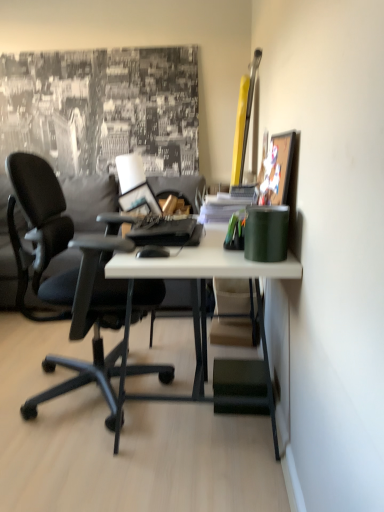
Question: Is white matte desk at center further to the viewer compared to green matte cup at right, placed as the first stationery when sorted from front to back?

Choices:
 (A) no
 (B) yes

Answer: (B)

Question: Does white matte desk at center have a greater width compared to green matte cup at right, placed as the first stationery when sorted from front to back?

Choices:
 (A) yes
 (B) no

Answer: (A)

Question: From the image's perspective, is white matte desk at center on top of green matte cup at right, which is the 2th stationery in back-to-front order?

Choices:
 (A) yes
 (B) no

Answer: (B)

Question: Is white matte desk at center outside of green matte cup at right, placed as the first stationery when sorted from front to back?

Choices:
 (A) no
 (B) yes

Answer: (B)

Question: Is white matte desk at center oriented away from green matte cup at right, which is the 2th stationery in back-to-front order?

Choices:
 (A) yes
 (B) no

Answer: (B)

Question: Is white matte desk at center not near green matte cup at right, placed as the first stationery when sorted from front to back?

Choices:
 (A) no
 (B) yes

Answer: (A)

Question: From the image's perspective, is satin black laptop at center beneath green matte cup at right, which is the 2th stationery in back-to-front order?

Choices:
 (A) no
 (B) yes

Answer: (A)

Question: Considering the relative sizes of satin black laptop at center and green matte cup at right, which is the 2th stationery in back-to-front order, in the image provided, is satin black laptop at center bigger than green matte cup at right, which is the 2th stationery in back-to-front order,?

Choices:
 (A) yes
 (B) no

Answer: (A)

Question: Considering the relative sizes of satin black laptop at center and green matte cup at right, which is the 2th stationery in back-to-front order, in the image provided, is satin black laptop at center thinner than green matte cup at right, which is the 2th stationery in back-to-front order,?

Choices:
 (A) yes
 (B) no

Answer: (B)

Question: Is satin black laptop at center closer to the viewer compared to green matte cup at right, which is the 2th stationery in back-to-front order?

Choices:
 (A) no
 (B) yes

Answer: (A)

Question: Is satin black laptop at center to the right of green matte cup at right, placed as the first stationery when sorted from front to back, from the viewer's perspective?

Choices:
 (A) no
 (B) yes

Answer: (A)

Question: Considering the relative sizes of satin black laptop at center and green matte cup at right, which is the 2th stationery in back-to-front order, in the image provided, is satin black laptop at center shorter than green matte cup at right, which is the 2th stationery in back-to-front order,?

Choices:
 (A) yes
 (B) no

Answer: (A)

Question: Would you consider wooden picture frame at upper right to be distant from black matte mouse at center?

Choices:
 (A) yes
 (B) no

Answer: (B)